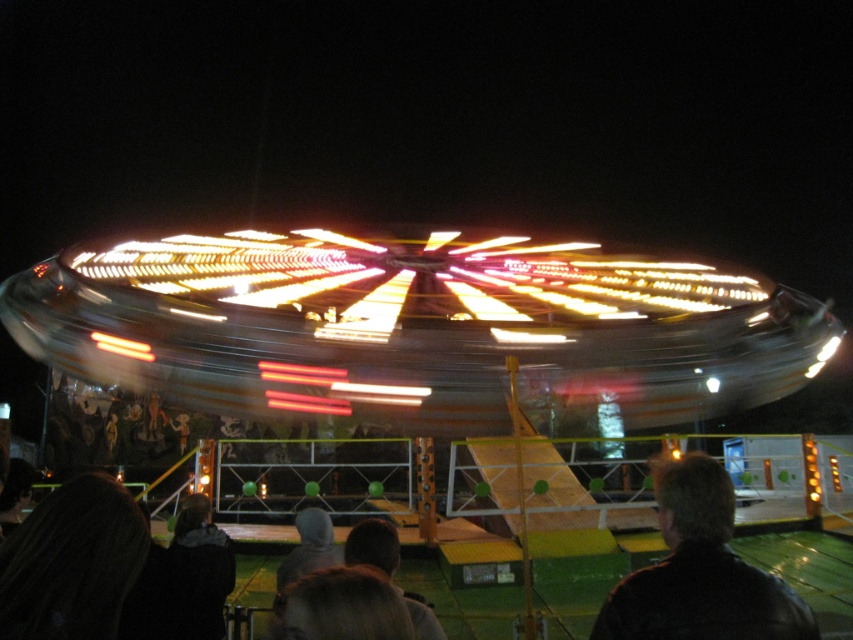
In the scene shown: You are standing at the fairground and want to take a photo of the metallic shiny carousel at center. If your camera can focus on objects up to 200 feet away, will you be able to capture a clear photo of the carousel?

The metallic shiny carousel at center is 208.57 feet away from the viewer. Since the camera can only focus up to 200 feet, the distance exceeds the camera limit. Therefore, the photo will not be clear.

You are at the fairground and want to take a photo of the metallic shiny carousel at center and the dark hair at lower left. Which object should you focus on first if you want to capture both in one frame without moving the camera?

You should focus on the metallic shiny carousel at center first because it is larger in size compared to the dark hair at lower left, making it more prominent in the frame.